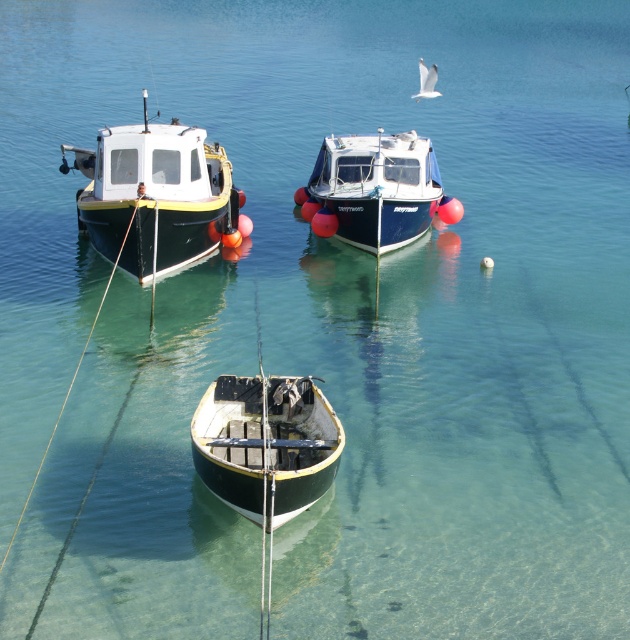
Does matte black boat at left have a lesser width compared to blue glossy boat at center?

Result: In fact, matte black boat at left might be wider than blue glossy boat at center.

Who is taller, matte black boat at left or blue glossy boat at center?

matte black boat at left is taller.

Where is `matte black boat at left`? matte black boat at left is located at coordinates (152, 195).

Which is below, green matte boat at center or blue glossy boat at center?

green matte boat at center is lower down.

Which is in front, point (261, 474) or point (430, 168)?

Positioned in front is point (261, 474).

Locate an element on the screen. green matte boat at center is located at coordinates (265, 444).

Between matte black boat at left and green matte boat at center, which one has less height?

green matte boat at center

Is point (214, 208) positioned behind point (210, 438)?

That is True.

At what (x,y) coordinates should I click in order to perform the action: click on matte black boat at left. Please return your answer as a coordinate pair (x, y). The width and height of the screenshot is (630, 640). Looking at the image, I should click on (152, 195).